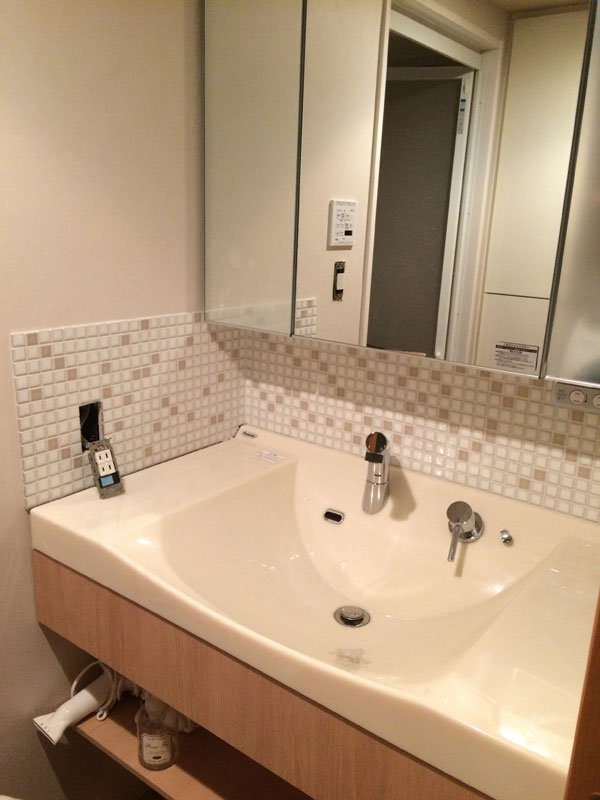
I want to click on sink, so click(x=448, y=600).